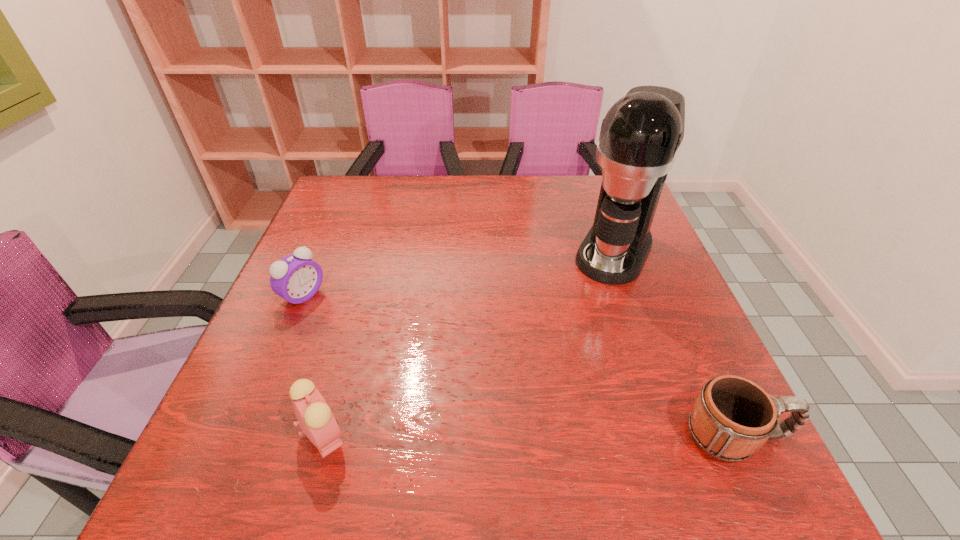
At what (x,y) coordinates should I click in order to perform the action: click on free space at the near edge of the desktop. Please return your answer as a coordinate pair (x, y). Image resolution: width=960 pixels, height=540 pixels. Looking at the image, I should click on (614, 431).

This screenshot has height=540, width=960. I want to click on free region at the left edge of the desktop, so click(x=344, y=235).

The height and width of the screenshot is (540, 960). Find the location of `vacant space at the right edge`. vacant space at the right edge is located at coordinates (655, 258).

Where is `free space at the far left corner of the desktop`? The height and width of the screenshot is (540, 960). free space at the far left corner of the desktop is located at coordinates (319, 210).

Find the location of `vacant area at the near left corner of the desktop`. vacant area at the near left corner of the desktop is located at coordinates (246, 405).

You are a GUI agent. You are given a task and a screenshot of the screen. Output one action in this format:
    pyautogui.click(x=<x>, y=<y>)
    Task: Click on the vacant space at the far right corner of the desktop
    
    Given the screenshot: What is the action you would take?
    pyautogui.click(x=584, y=204)

Identify the location of vacant area that lies between the left alarm clock and the tallest object. This screenshot has width=960, height=540. (459, 273).

Where is `free space between the coffee maker and the farther alarm clock`? The width and height of the screenshot is (960, 540). free space between the coffee maker and the farther alarm clock is located at coordinates (459, 273).

At what (x,y) coordinates should I click in order to perform the action: click on vacant region between the mug and the tallest object. Please return your answer as a coordinate pair (x, y). The height and width of the screenshot is (540, 960). Looking at the image, I should click on (676, 343).

At what (x,y) coordinates should I click in order to perform the action: click on free space between the right alarm clock and the left alarm clock. Please return your answer as a coordinate pair (x, y). Looking at the image, I should click on [x=314, y=365].